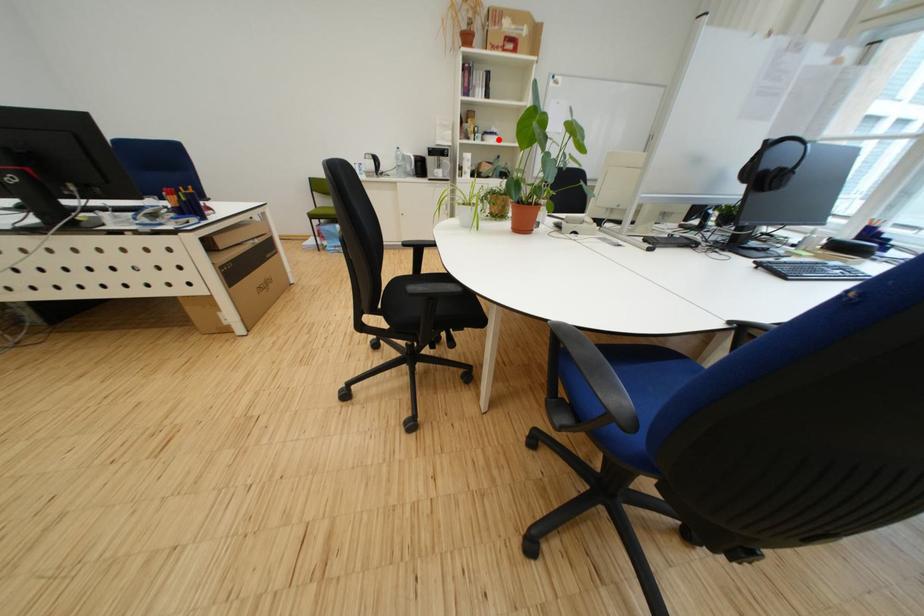
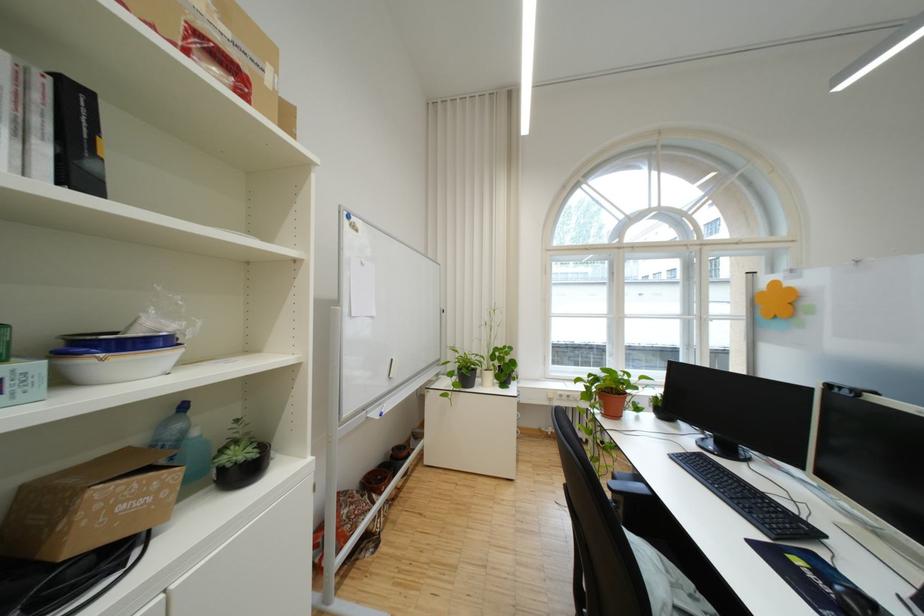
Find the pixel in the second image that matches the highlighted location in the first image.

(117, 365)